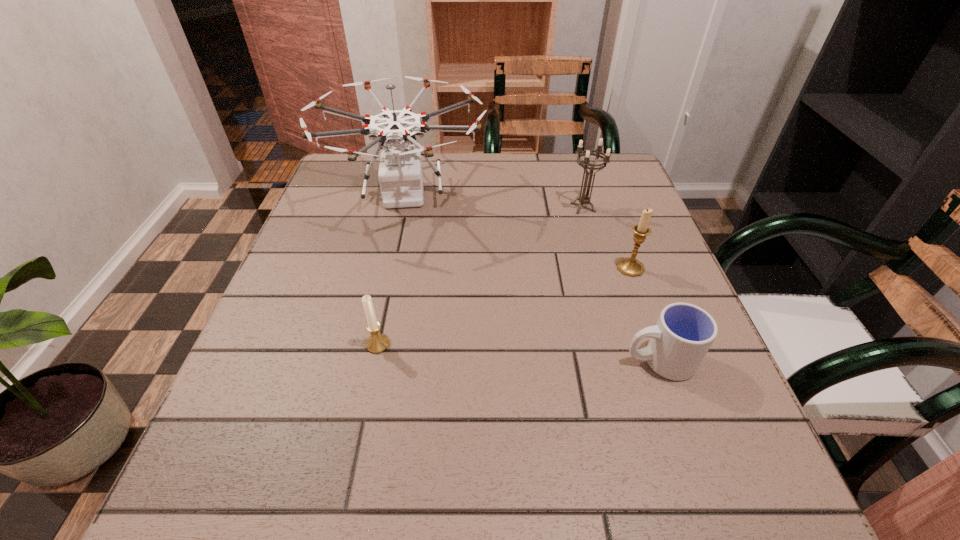
The width and height of the screenshot is (960, 540). Find the location of `vacant space that's between the third nearest object and the farthest candle holder`. vacant space that's between the third nearest object and the farthest candle holder is located at coordinates (607, 238).

Identify the location of free space between the drone and the shortest object. Image resolution: width=960 pixels, height=540 pixels. (532, 278).

Where is `free spot between the drone and the cup`? The image size is (960, 540). free spot between the drone and the cup is located at coordinates (532, 278).

Locate an element on the screen. The height and width of the screenshot is (540, 960). vacant area that lies between the second shortest object and the drone is located at coordinates (392, 269).

The width and height of the screenshot is (960, 540). Identify the location of free area in between the tallest object and the second farthest candle holder. (517, 231).

Image resolution: width=960 pixels, height=540 pixels. Find the location of `object that is the second closest to the shortest object`. object that is the second closest to the shortest object is located at coordinates (400, 174).

The image size is (960, 540). I want to click on the fourth closest object to the shortest object, so click(378, 342).

Point out which candle holder is positioned as the nearest to the farthest candle holder. Please provide its 2D coordinates. Your answer should be formatted as a tuple, i.e. [(x, y)], where the tuple contains the x and y coordinates of a point satisfying the conditions above.

[(630, 266)]

Identify which candle holder is the second closest to the farthest candle holder. Please provide its 2D coordinates. Your answer should be formatted as a tuple, i.e. [(x, y)], where the tuple contains the x and y coordinates of a point satisfying the conditions above.

[(378, 342)]

Locate an element on the screen. vacant region that satisfies the following two spatial constraints: 1. on the back side of the farthest candle holder; 2. on the left side of the second shortest object is located at coordinates (406, 207).